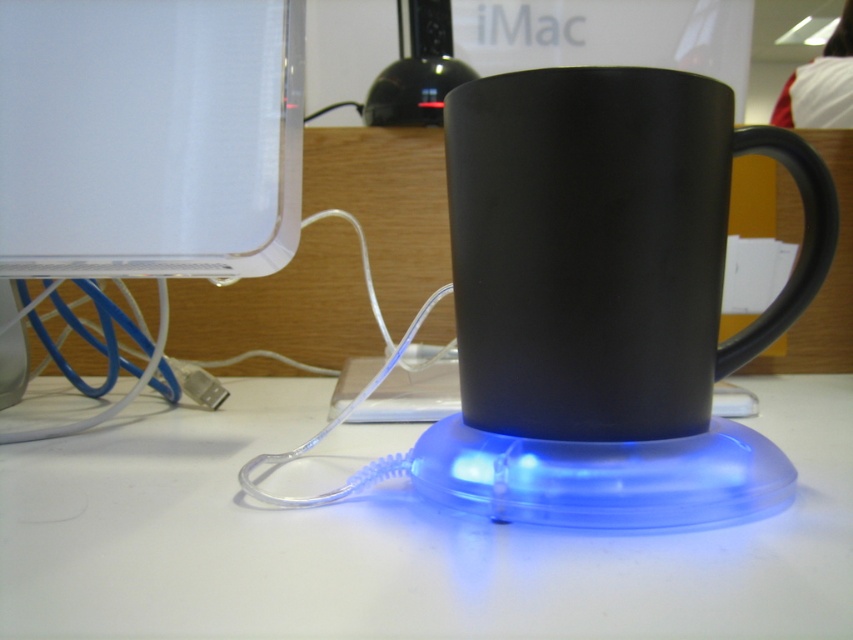
Question: Which point is farther to the camera?

Choices:
 (A) (726, 132)
 (B) (146, 108)

Answer: (B)

Question: Based on their relative distances, which object is farther from the transparent plastic base at center?

Choices:
 (A) transparent plastic monitor at upper left
 (B) matte black mug at center

Answer: (A)

Question: Which of these objects is positioned closest to the matte black mug at center?

Choices:
 (A) transparent plastic monitor at upper left
 (B) transparent plastic base at center

Answer: (B)

Question: Can you confirm if transparent plastic base at center is bigger than transparent plastic monitor at upper left?

Choices:
 (A) yes
 (B) no

Answer: (A)

Question: Does matte black mug at center appear on the left side of transparent plastic monitor at upper left?

Choices:
 (A) yes
 (B) no

Answer: (B)

Question: Can you confirm if transparent plastic base at center is positioned to the right of transparent plastic monitor at upper left?

Choices:
 (A) yes
 (B) no

Answer: (A)